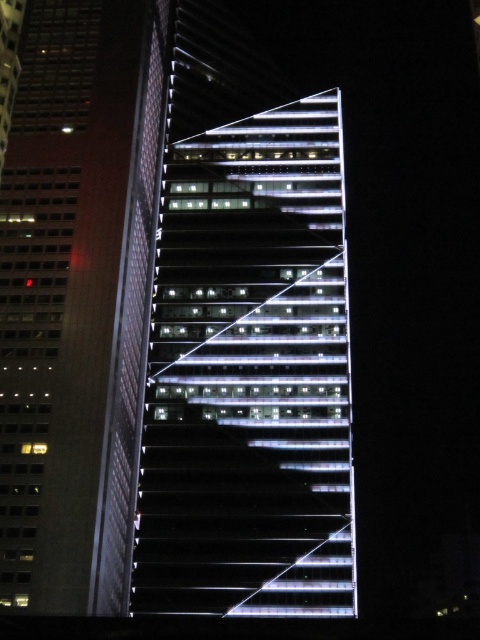
In the scene shown: You are standing on the sidewalk in front of the skyscraper. You want to take a photo of the white glass building at center. If your camera can focus on objects up to 250 feet away, will you need to move closer to get a clear shot?

The white glass building at center is 267.89 feet away from the viewer. Since the camera can only focus up to 250 feet, you need to move closer to ensure the building is within the camera range.

Based on the photo, you are standing on a balcony overlooking the city and see both the white glass building at center and the matte glass skyscraper at left. Which building is closer to your right side?

The white glass building at center is positioned on the right side of matte glass skyscraper at left, so it is closer to your right side.

You are standing in front of the skyscraper and notice a point marked at coordinates (250, 376). Based on the description, where is this point located?

The point at (250, 376) is located on the white glass building at center.